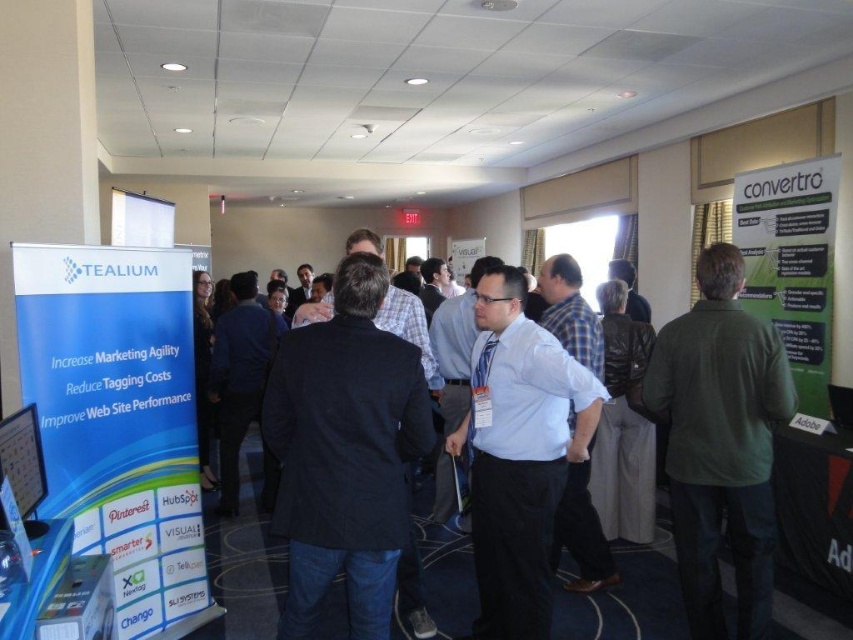
You are standing at the entrance of the conference hall and see the green cotton shirt at right. If you want to move towards it, in which general direction should you walk?

The green cotton shirt at right is located at coordinates approximately 0.694 on the x axis and 0.845 on the y axis. Since the shirt is at the right side of the image, you should walk towards the right direction to reach it.

You are at a conference and want to approach the person wearing the green cotton shirt at right and the white shirt at center. Which one is closer to the right side of the room?

The green cotton shirt at right is positioned on the right side of white shirt at center, so the green cotton shirt at right is closer to the right side of the room.